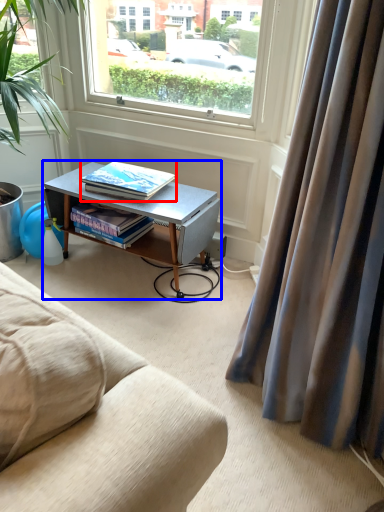
Question: Which point is closer to the camera, book (highlighted by a red box) or desk (highlighted by a blue box)?

Choices:
 (A) book
 (B) desk

Answer: (B)